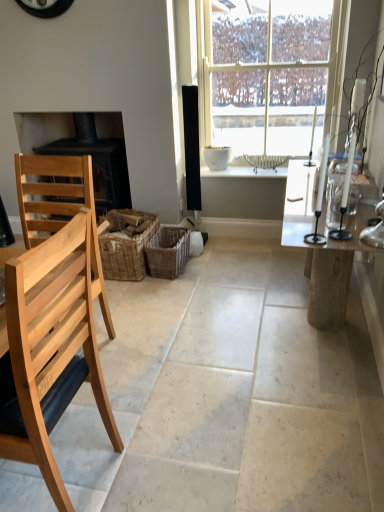
Where is `vacant area situated below natural wood chair at left, the first chair when ordered from front to back (from a real-world perspective)`? The width and height of the screenshot is (384, 512). vacant area situated below natural wood chair at left, the first chair when ordered from front to back (from a real-world perspective) is located at coordinates (59, 469).